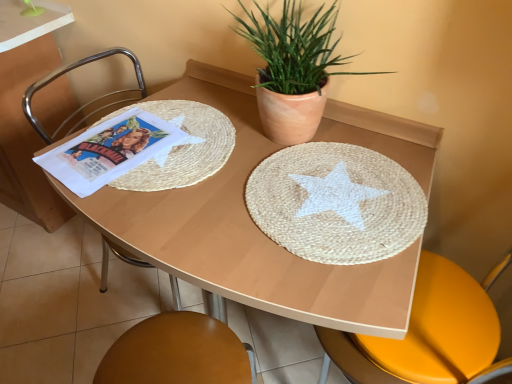
You are a GUI agent. You are given a task and a screenshot of the screen. Output one action in this format:
    pyautogui.click(x=<x>, y=<y>)
    Task: Click on the terracotta clay pot at upper center
    
    Given the screenshot: What is the action you would take?
    pyautogui.click(x=293, y=69)

Measure the distance between white paper comic book at left and camera.

white paper comic book at left is 34.48 inches from camera.

What do you see at coordinates (108, 150) in the screenshot?
I see `white paper comic book at left` at bounding box center [108, 150].

Where is `wooden table at center`? wooden table at center is located at coordinates (245, 232).

The height and width of the screenshot is (384, 512). What do you see at coordinates (71, 70) in the screenshot? I see `brushed metal chair at left` at bounding box center [71, 70].

You are a GUI agent. You are given a task and a screenshot of the screen. Output one action in this format:
    pyautogui.click(x=<x>, y=<y>)
    Task: Click on the terracotta clay pot at upper center
    The image size is (512, 384).
    Given the screenshot: What is the action you would take?
    pyautogui.click(x=293, y=69)

Who is taller, brushed metal chair at left or terracotta clay pot at upper center?

brushed metal chair at left.

Does point (27, 97) come behind point (290, 79)?

Yes, point (27, 97) is behind point (290, 79).

Is brushed metal chair at left with terracotta clay pot at upper center?

brushed metal chair at left is not next to terracotta clay pot at upper center, and they're not touching.

From the image's perspective, who appears lower, wooden table at center or white paper comic book at left?

wooden table at center, from the image's perspective.

From a real-world perspective, between wooden table at center and white paper comic book at left, who is vertically higher?

white paper comic book at left.

Identify the location of comic book above the wooden table at center (from a real-world perspective). (108, 150).

Is wooden table at center beside white paper comic book at left?

There is a gap between wooden table at center and white paper comic book at left.

Identify the location of table in front of the white paper comic book at left. (245, 232).

Is white paper comic book at left surrounding wooden table at center?

No, white paper comic book at left does not contain wooden table at center.

Which object is positioned more to the left, white paper comic book at left or wooden table at center?

white paper comic book at left is more to the left.

From the image's perspective, which one is positioned lower, white paper comic book at left or wooden table at center?

wooden table at center is shown below in the image.

From the image's perspective, is terracotta clay pot at upper center beneath white paper comic book at left?

No.

Could you tell me if terracotta clay pot at upper center is facing white paper comic book at left?

No, terracotta clay pot at upper center is not facing towards white paper comic book at left.

Would you say white paper comic book at left is part of terracotta clay pot at upper center's contents?

Actually, white paper comic book at left is outside terracotta clay pot at upper center.

Which point is more forward, (321, 176) or (146, 94)?

The point (321, 176) is closer.

What are the coordinates of `paper plate above the brushed metal chair at left (from the image's perspective)` in the screenshot? It's located at (336, 203).

Can you confirm if natural fiber placemat at center is wider than brushed metal chair at left?

Yes, natural fiber placemat at center is wider than brushed metal chair at left.

From a real-world perspective, is natural fiber placemat at center on top of brushed metal chair at left?

Yes.

Is natural fiber placemat at center inside or outside of wooden table at center?

natural fiber placemat at center is inside wooden table at center.

Considering the relative sizes of natural fiber placemat at center and wooden table at center in the image provided, is natural fiber placemat at center smaller than wooden table at center?

Indeed, natural fiber placemat at center has a smaller size compared to wooden table at center.

Is there a large distance between natural fiber placemat at center and wooden table at center?

Actually, natural fiber placemat at center and wooden table at center are a little close together.

From the image's perspective, is natural fiber placemat at center positioned above or below wooden table at center?

natural fiber placemat at center is above wooden table at center.

Does natural fiber placemat at center have a larger size compared to white paper comic book at left?

Correct, natural fiber placemat at center is larger in size than white paper comic book at left.

Is natural fiber placemat at center far away from white paper comic book at left?

No.

Find the location of a particular element. chair lying on the left of terracotta clay pot at upper center is located at coordinates (71, 70).

Find the location of a particular element. The width and height of the screenshot is (512, 384). comic book above the wooden table at center (from the image's perspective) is located at coordinates (108, 150).

Based on their spatial positions, is white paper comic book at left or wooden table at center further from natural fiber placemat at center?

The object further to natural fiber placemat at center is white paper comic book at left.

Which object lies nearer to the anchor point wooden table at center, white paper comic book at left or terracotta clay pot at upper center?

terracotta clay pot at upper center.

When comparing their distances from wooden table at center, does terracotta clay pot at upper center or natural fiber placemat at center seem further?

terracotta clay pot at upper center is positioned further to the anchor wooden table at center.

When comparing their distances from natural fiber placemat at center, does wooden table at center or brushed metal chair at left seem closer?

wooden table at center is closer to natural fiber placemat at center.

Based on their spatial positions, is brushed metal chair at left or white paper comic book at left further from natural fiber placemat at center?

The object further to natural fiber placemat at center is brushed metal chair at left.

From the image, which object appears to be nearer to terracotta clay pot at upper center, natural fiber placemat at center or white paper comic book at left?

The object closer to terracotta clay pot at upper center is natural fiber placemat at center.

Based on their spatial positions, is brushed metal chair at left or wooden table at center further from terracotta clay pot at upper center?

The object further to terracotta clay pot at upper center is brushed metal chair at left.

Estimate the real-world distances between objects in this image. Which object is further from terracotta clay pot at upper center, white paper comic book at left or natural fiber placemat at center?

Based on the image, white paper comic book at left appears to be further to terracotta clay pot at upper center.

Image resolution: width=512 pixels, height=384 pixels. I want to click on table located between white paper comic book at left and natural fiber placemat at center in the left-right direction, so click(x=245, y=232).

The width and height of the screenshot is (512, 384). I want to click on paper plate between terracotta clay pot at upper center and wooden table at center in the vertical direction, so click(x=336, y=203).

Where is `comic book between terracotta clay pot at upper center and wooden table at center in the up-down direction`? comic book between terracotta clay pot at upper center and wooden table at center in the up-down direction is located at coordinates (108, 150).

This screenshot has width=512, height=384. I want to click on comic book located between brushed metal chair at left and wooden table at center in the left-right direction, so click(108, 150).